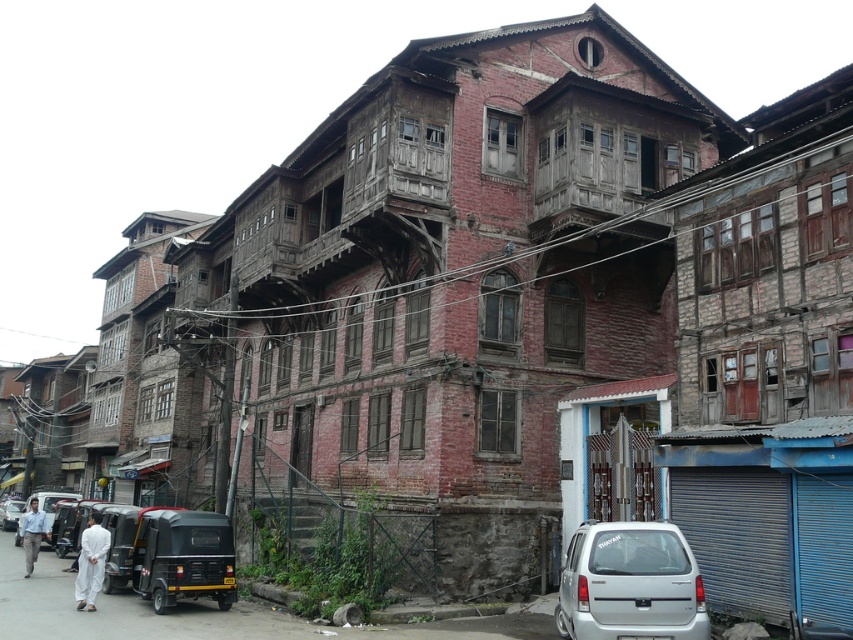
In the scene shown: Which is above, silver metallic van at lower right or white cotton pants at lower left?

silver metallic van at lower right

Is point (640, 584) farther from camera compared to point (86, 589)?

No, it is in front of (86, 589).

Where is `silver metallic van at lower right`? Image resolution: width=853 pixels, height=640 pixels. silver metallic van at lower right is located at coordinates pos(630,582).

Is white cotton pants at lower left above light blue shirt at lower left?

Yes, white cotton pants at lower left is above light blue shirt at lower left.

Is white cotton pants at lower left to the left of light blue shirt at lower left from the viewer's perspective?

No, white cotton pants at lower left is not to the left of light blue shirt at lower left.

Does point (88, 540) come behind point (36, 508)?

No.

Where is `white cotton pants at lower left`? This screenshot has width=853, height=640. white cotton pants at lower left is located at coordinates (91, 563).

Is white cotton pants at lower left positioned in front of black matte car at lower left?

Yes, it is.

Does white cotton pants at lower left have a lesser width compared to black matte car at lower left?

Correct, white cotton pants at lower left's width is less than black matte car at lower left's.

Which is in front, point (97, 584) or point (24, 502)?

Positioned in front is point (97, 584).

I want to click on white cotton pants at lower left, so click(91, 563).